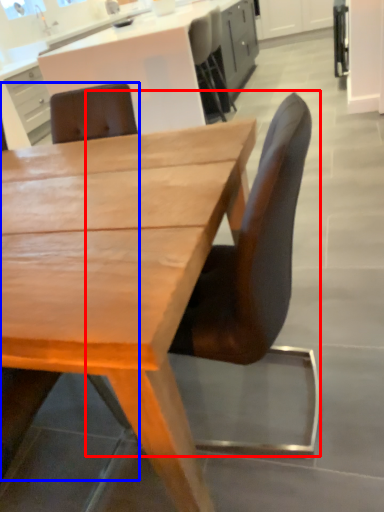
Question: Which of the following is the farthest to the observer, chair (highlighted by a red box) or chair (highlighted by a blue box)?

Choices:
 (A) chair
 (B) chair

Answer: (A)